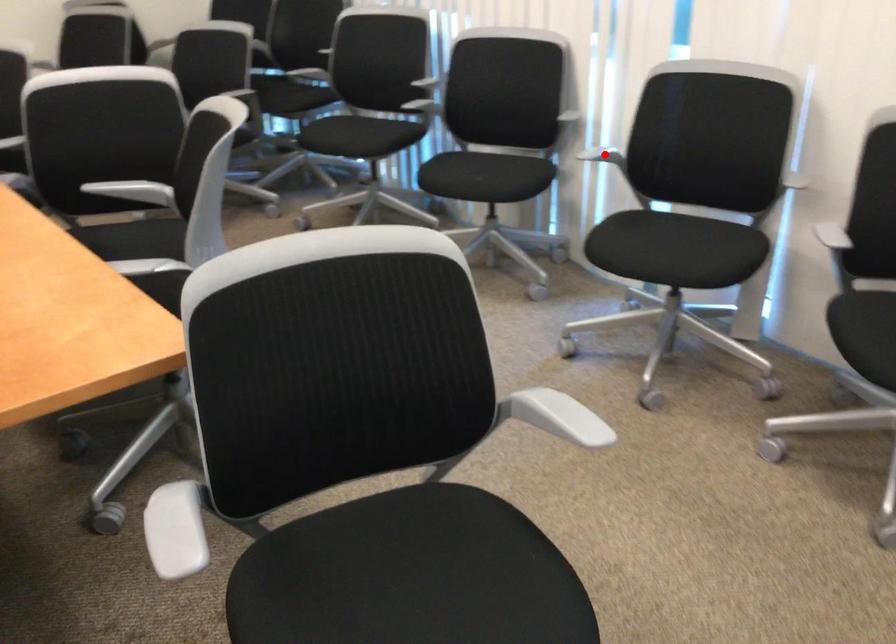
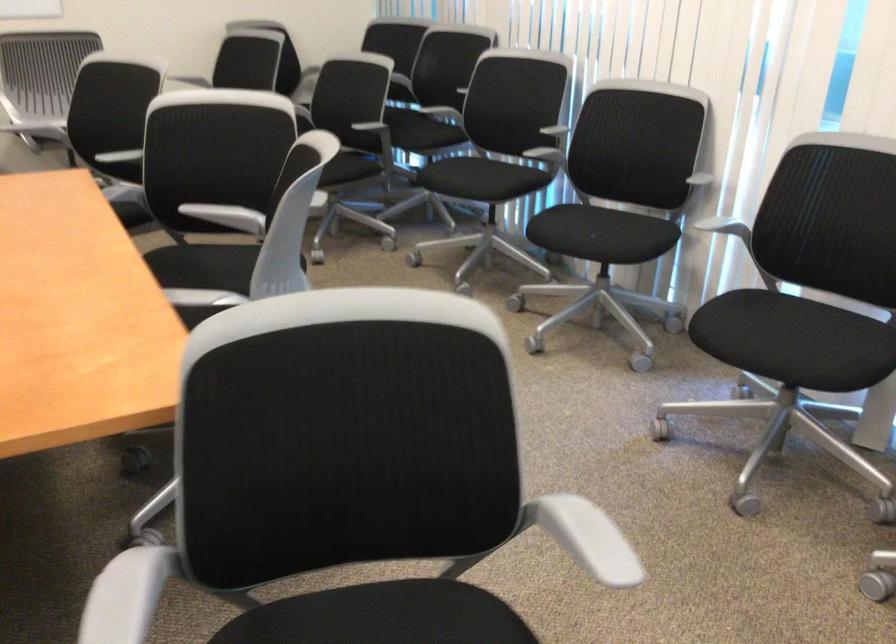
Question: I am providing you with two images of the same scene from different viewpoints. Image1 has a red point marked. In image2, the corresponding 3D location appears at what relative position? Reply with the corresponding letter.

Choices:
 (A) Closer
 (B) Farther

Answer: (A)